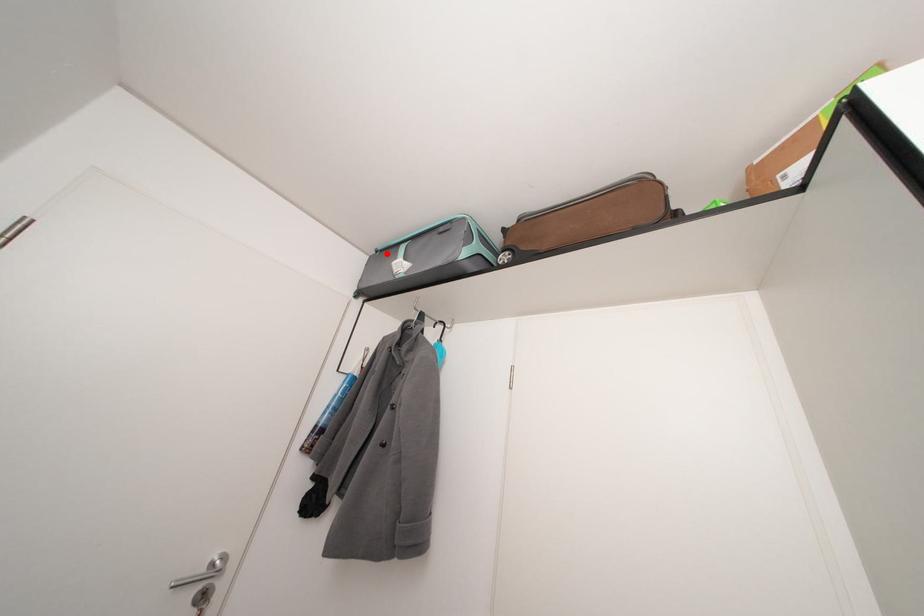
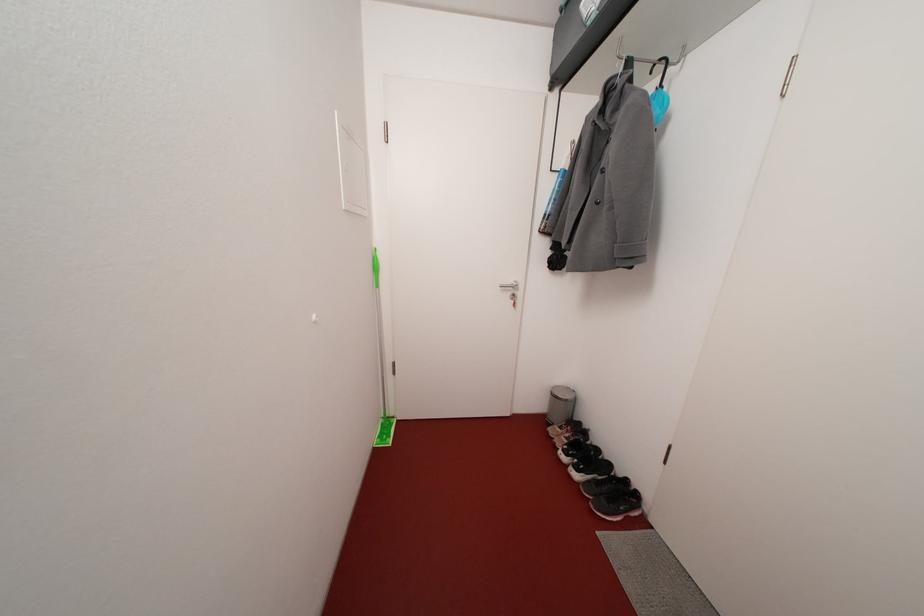
Find the pixel in the second image that matches the highlighted location in the first image.

(570, 7)